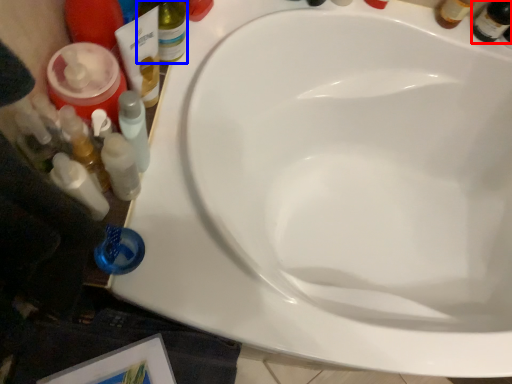
Question: Which object appears closest to the camera in this image, beer bottle (highlighted by a red box) or bottle (highlighted by a blue box)?

Choices:
 (A) beer bottle
 (B) bottle

Answer: (B)